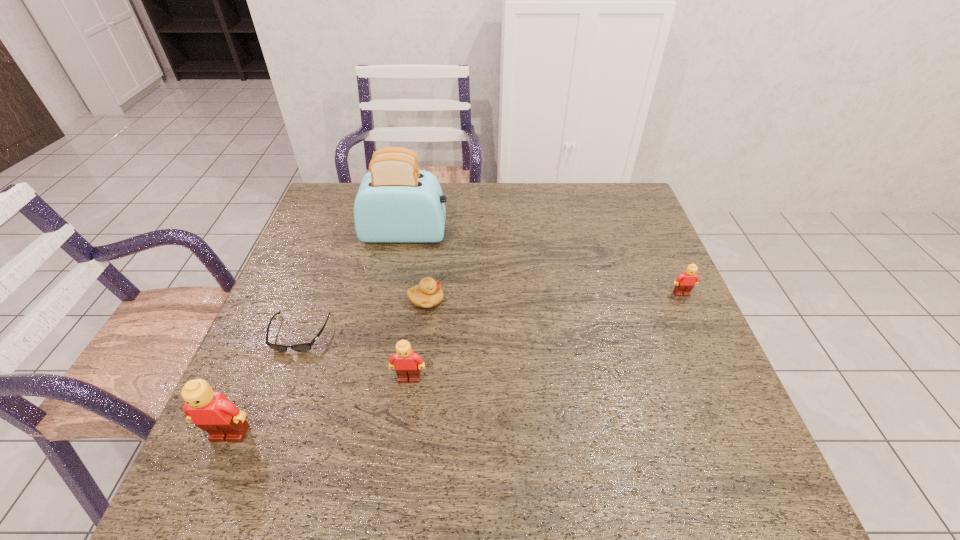
The image size is (960, 540). In order to click on sunglasses in this screenshot , I will do `click(304, 347)`.

Identify the location of vacant space located 0.070m on the face of the fifth farthest object. (404, 414).

Locate an element on the screen. free point located 0.250m on the face of the rightmost object is located at coordinates (721, 381).

This screenshot has height=540, width=960. Identify the location of free space located at the beak of the fifth tallest object. (518, 300).

Find the location of a particular element. free space located on the side of the toaster with the lever is located at coordinates (498, 234).

Where is `free space located on the front-facing side of the fourth farthest object`? free space located on the front-facing side of the fourth farthest object is located at coordinates (283, 377).

The image size is (960, 540). What are the coordinates of `object at the far edge` in the screenshot? It's located at (396, 202).

Locate an element on the screen. object that is positioned at the near edge is located at coordinates (213, 412).

Locate an element on the screen. This screenshot has width=960, height=540. Lego that is positioned at the left edge is located at coordinates (213, 412).

This screenshot has width=960, height=540. Find the location of `sunglasses at the left edge`. sunglasses at the left edge is located at coordinates (304, 347).